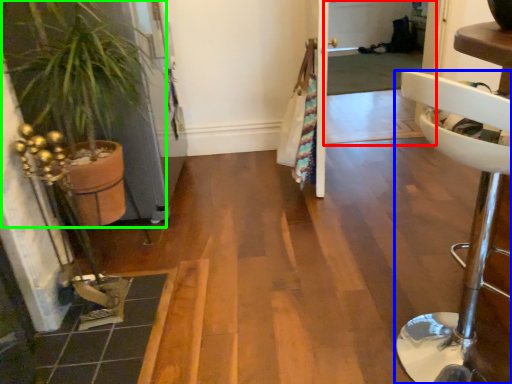
Question: Considering the real-world distances, which object is farthest from screen door (highlighted by a red box)? furniture (highlighted by a blue box) or houseplant (highlighted by a green box)?

Choices:
 (A) furniture
 (B) houseplant

Answer: (A)